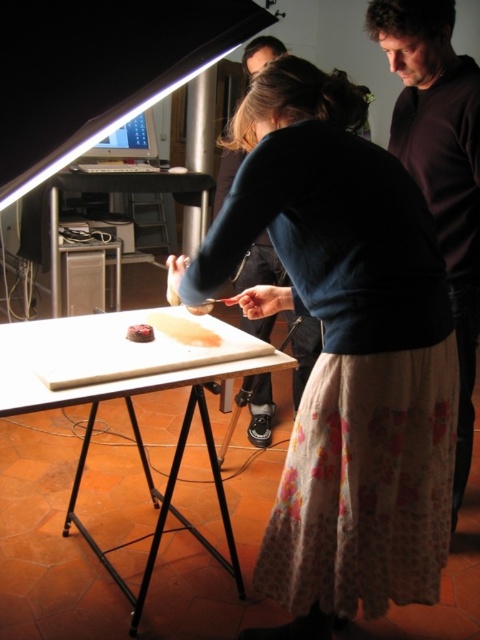
Which is behind, point (159, 316) or point (145, 330)?

Positioned behind is point (159, 316).

Is brown matte cake at center closer to the viewer compared to chocolate cake at center?

Yes.

Between point (216, 337) and point (149, 337), which one is positioned in front?

Point (149, 337) is more forward.

Find the location of a particular element. The width and height of the screenshot is (480, 640). brown matte cake at center is located at coordinates 183,330.

Which of these two, matte blue sweater at center or dark brown sweater at upper right, stands shorter?

matte blue sweater at center is shorter.

Consider the image. Who is more forward, (322,227) or (448,168)?

Positioned in front is point (322,227).

Is point (357, 252) positioned after point (478, 220)?

No.

Where is `matte blue sweater at center`? This screenshot has height=640, width=480. matte blue sweater at center is located at coordinates (343, 349).

Is point (248, 381) positioned behind point (131, 332)?

Yes, it is.

Between dark brown leather jacket at upper center and chocolate cake at center, which one is positioned higher?

chocolate cake at center is above.

In order to click on dark brown leather jacket at upper center in this screenshot , I will do `click(260, 266)`.